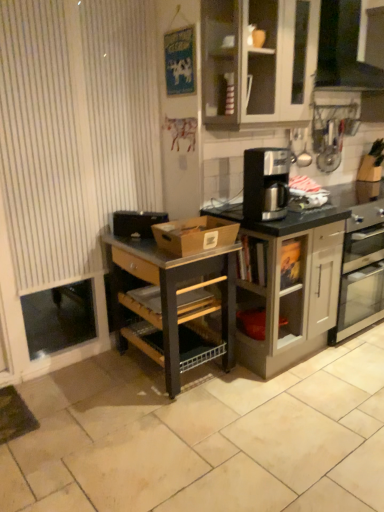
You are a GUI agent. You are given a task and a screenshot of the screen. Output one action in this format:
    pyautogui.click(x=<x>, y=<y>)
    Task: Click on the free space in front of matte gray cabinet at center, which is the 2th cabinetry in top-to-bottom order
    
    Given the screenshot: What is the action you would take?
    pyautogui.click(x=284, y=405)